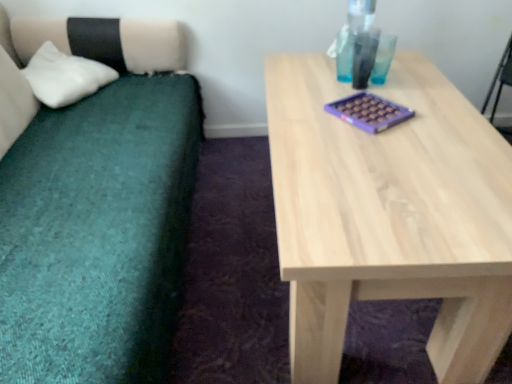
Question: Is teal fabric couch at left thinner than white soft pillow at left?

Choices:
 (A) yes
 (B) no

Answer: (B)

Question: Does teal fabric couch at left have a smaller size compared to white soft pillow at left?

Choices:
 (A) no
 (B) yes

Answer: (A)

Question: From a real-world perspective, is teal fabric couch at left under white soft pillow at left?

Choices:
 (A) yes
 (B) no

Answer: (A)

Question: From a real-world perspective, is teal fabric couch at left over white soft pillow at left?

Choices:
 (A) yes
 (B) no

Answer: (B)

Question: Are teal fabric couch at left and white soft pillow at left located far from each other?

Choices:
 (A) no
 (B) yes

Answer: (A)

Question: Is natural wood table at center wider or thinner than white soft pillow at left?

Choices:
 (A) thin
 (B) wide

Answer: (B)

Question: Is natural wood table at center spatially inside white soft pillow at left, or outside of it?

Choices:
 (A) outside
 (B) inside

Answer: (A)

Question: Is natural wood table at center in front of or behind white soft pillow at left in the image?

Choices:
 (A) behind
 (B) front

Answer: (B)

Question: Is point (443, 274) closer or farther from the camera than point (48, 76)?

Choices:
 (A) farther
 (B) closer

Answer: (B)

Question: Relative to white soft pillow at left, is teal fabric couch at left in front or behind?

Choices:
 (A) front
 (B) behind

Answer: (A)

Question: Considering the positions of teal fabric couch at left and white soft pillow at left in the image, is teal fabric couch at left wider or thinner than white soft pillow at left?

Choices:
 (A) thin
 (B) wide

Answer: (B)

Question: Considering the positions of teal fabric couch at left and white soft pillow at left in the image, is teal fabric couch at left taller or shorter than white soft pillow at left?

Choices:
 (A) short
 (B) tall

Answer: (B)

Question: From the image's perspective, is teal fabric couch at left located above or below white soft pillow at left?

Choices:
 (A) below
 (B) above

Answer: (A)

Question: Do you think natural wood table at center is within teal fabric couch at left, or outside of it?

Choices:
 (A) inside
 (B) outside

Answer: (B)

Question: Based on their positions, is natural wood table at center located to the left or right of teal fabric couch at left?

Choices:
 (A) right
 (B) left

Answer: (A)